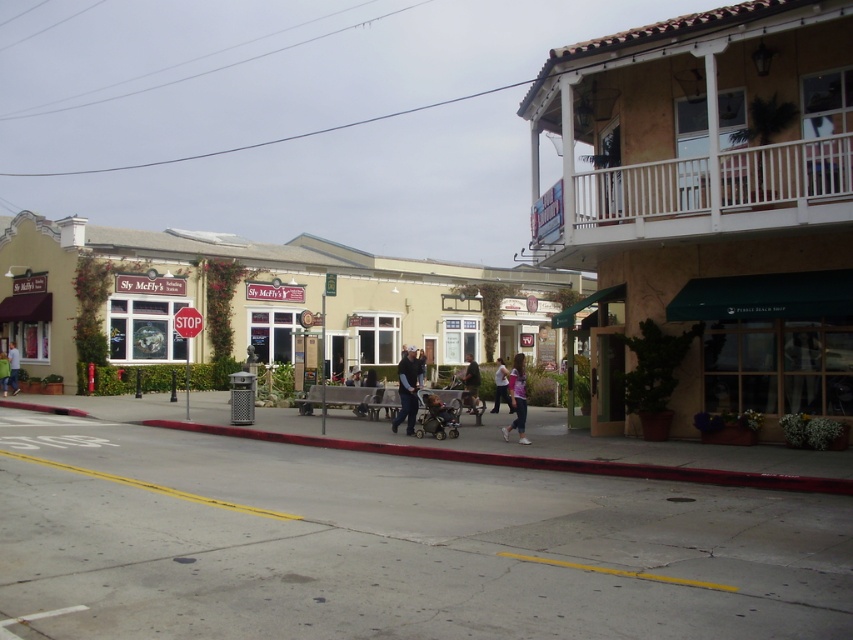
Question: Considering the real-world distances, which object is closest to the green fabric jacket at center?

Choices:
 (A) beige stucco building at upper right
 (B) denim pants at center
 (C) light pink fabric pants at center

Answer: (B)

Question: Is dark blue jeans at center bigger than pink fabric jacket at center?

Choices:
 (A) yes
 (B) no

Answer: (B)

Question: Estimate the real-world distances between objects in this image. Which object is farther from the denim pants at center?

Choices:
 (A) pink fabric jacket at center
 (B) beige stucco building at upper right
 (C) light pink fabric pants at center

Answer: (B)

Question: Does gray concrete sidewalk at center have a larger size compared to pink fabric jacket at center?

Choices:
 (A) no
 (B) yes

Answer: (B)

Question: Which point is farther to the camera?

Choices:
 (A) beige stucco building at center
 (B) green fabric jacket at center

Answer: (B)

Question: Is beige stucco building at center positioned before green fabric jacket at center?

Choices:
 (A) no
 (B) yes

Answer: (B)